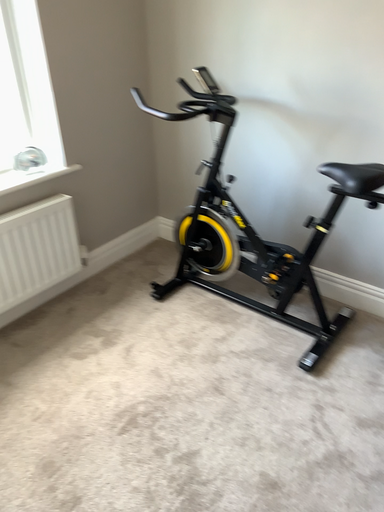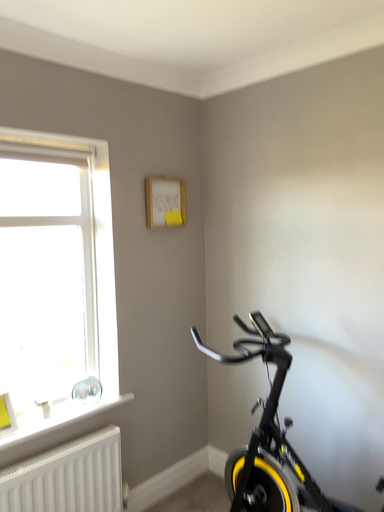
Question: How did the camera likely rotate when shooting the video?

Choices:
 (A) rotated downward
 (B) rotated upward

Answer: (B)